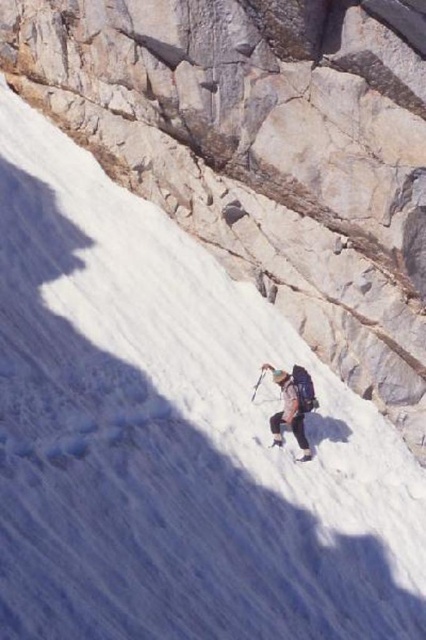
Question: Which object is farther from the camera taking this photo?

Choices:
 (A) white plastic ski pole at center
 (B) white matte ski at center

Answer: (A)

Question: Based on their relative distances, which object is nearer to the camouflage fabric jacket at center?

Choices:
 (A) white plastic ski pole at center
 (B) white matte ski at center

Answer: (B)

Question: Can you confirm if camouflage fabric jacket at center is thinner than white plastic ski pole at center?

Choices:
 (A) yes
 (B) no

Answer: (B)

Question: Can you confirm if camouflage fabric jacket at center is smaller than white plastic ski pole at center?

Choices:
 (A) yes
 (B) no

Answer: (B)

Question: Which object is farther from the camera taking this photo?

Choices:
 (A) white matte ski at center
 (B) white plastic ski pole at center
 (C) camouflage fabric jacket at center

Answer: (B)

Question: Does white matte ski at center come in front of white plastic ski pole at center?

Choices:
 (A) yes
 (B) no

Answer: (A)